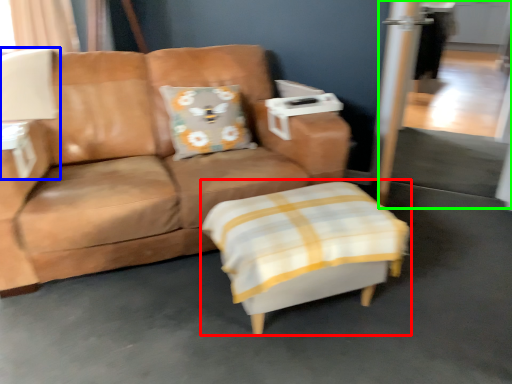
Question: Considering the real-world distances, which object is closest to swivel chair (highlighted by a red box)? table lamp (highlighted by a blue box) or screen door (highlighted by a green box).

Choices:
 (A) table lamp
 (B) screen door

Answer: (B)